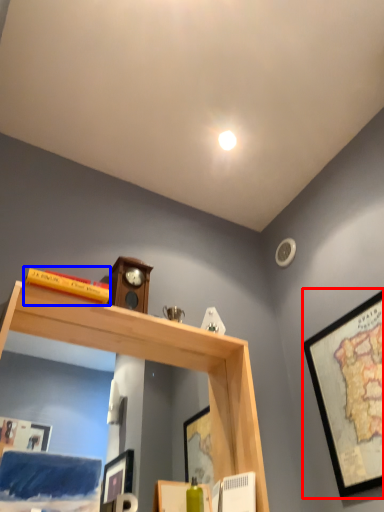
Question: Which of the following is the closest to the observer, picture frame (highlighted by a red box) or book (highlighted by a blue box)?

Choices:
 (A) picture frame
 (B) book

Answer: (A)